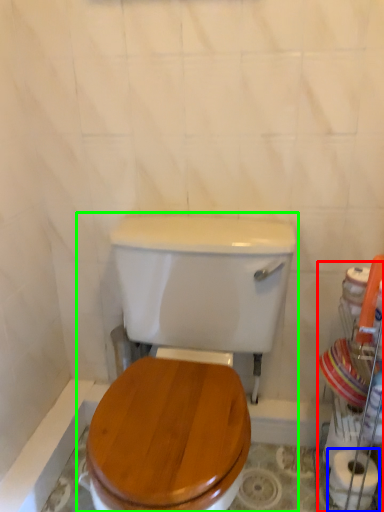
Question: Which object is positioned closest to porcelain (highlighted by a red box)? Select from toilet paper (highlighted by a blue box) and toilet (highlighted by a green box).

Choices:
 (A) toilet paper
 (B) toilet

Answer: (A)